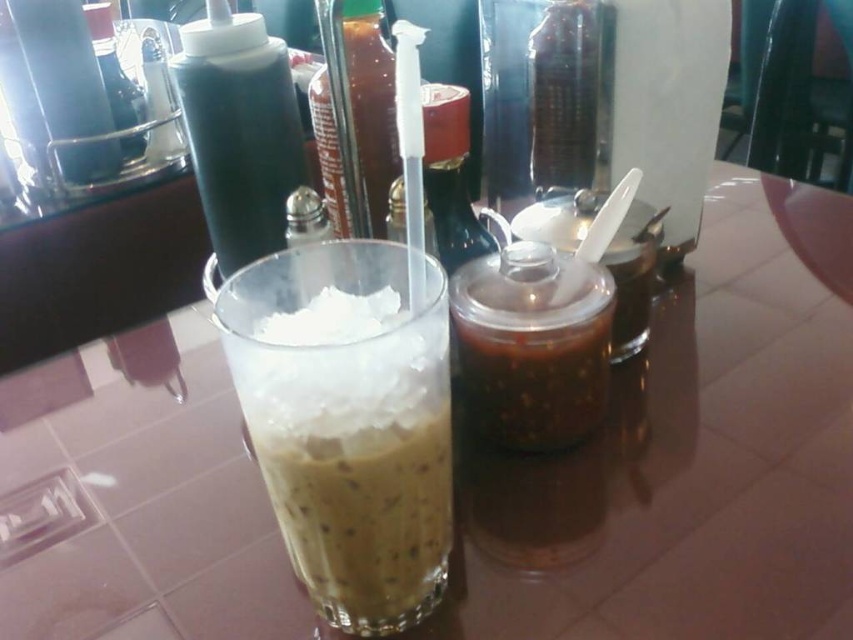
You are a delivery person who needs to place a package on the table. The package is 30 centimeters wide. The package must be placed so that it does not cover the point at coordinate point (383, 108). Is there enough space on the table to place the package without covering the point?

The distance between point (383, 108) and the camera is 37.55 centimeters. Since the package is 30 centimeters wide, there is enough space to place it without covering the point as the available space is larger than the package width.

You are a delivery robot that is 18 inches wide. You need to move from the transparent plastic bottle at upper left to the clear plastic bottle at center. Is there enough space for you to pass through the gap between them?

The distance between the clear plastic bottle at center and the transparent plastic bottle at upper left is 20.57 inches. Since the robot is 18 inches wide, there is enough space for it to pass through the gap between them.